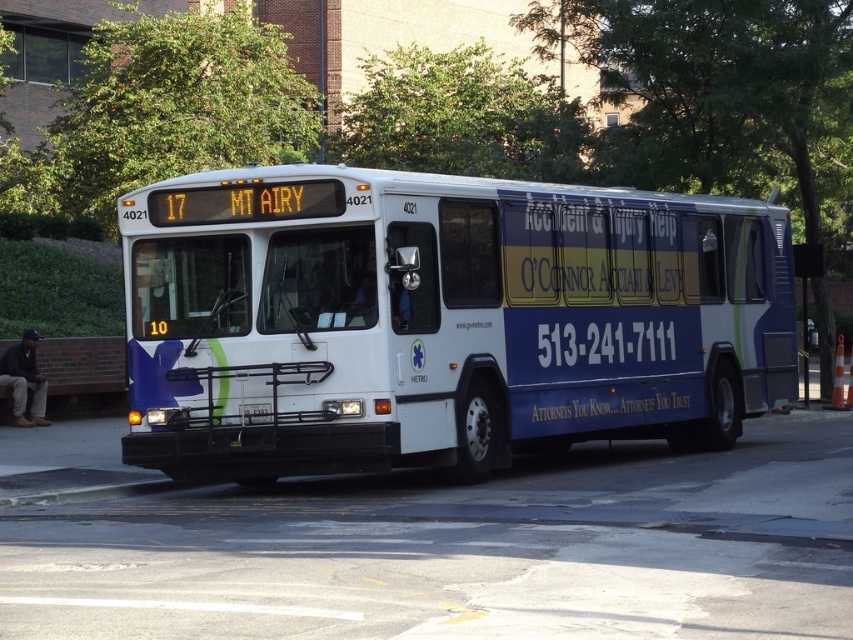
Who is positioned more to the right, white glossy bus at center or black plastic license plate at center?

From the viewer's perspective, white glossy bus at center appears more on the right side.

Between point (604, 257) and point (267, 406), which one is positioned behind?

Point (604, 257)

At what (x,y) coordinates should I click in order to perform the action: click on white glossy bus at center. Please return your answer as a coordinate pair (x, y). Image resolution: width=853 pixels, height=640 pixels. Looking at the image, I should click on (440, 320).